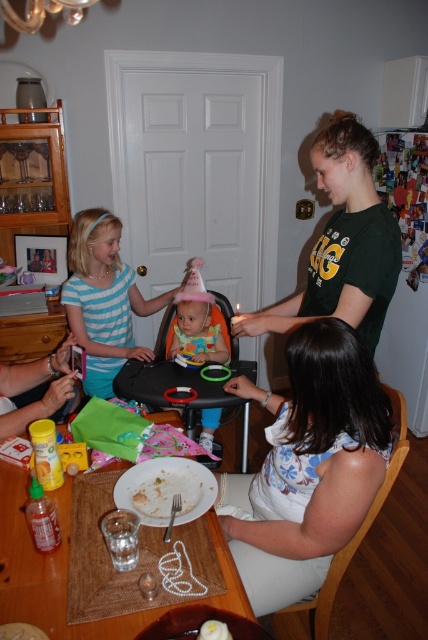
Is white ceramic plate at lower center to the left of striped fabric dress at center from the viewer's perspective?

In fact, white ceramic plate at lower center is to the right of striped fabric dress at center.

Is white ceramic plate at lower center wider than striped fabric dress at center?

Indeed, white ceramic plate at lower center has a greater width compared to striped fabric dress at center.

Describe the element at coordinates (47, 570) in the screenshot. I see `white ceramic plate at lower center` at that location.

Find the location of `white ceramic plate at lower center`. white ceramic plate at lower center is located at coordinates coord(47,570).

This screenshot has height=640, width=428. Describe the element at coordinates (308, 467) in the screenshot. I see `white floral tank top at lower center` at that location.

Can you confirm if white floral tank top at lower center is positioned to the left of matte pink party hat at center?

Incorrect, white floral tank top at lower center is not on the left side of matte pink party hat at center.

Between point (300, 456) and point (202, 259), which one is positioned in front?

Point (300, 456) is in front.

The image size is (428, 640). I want to click on white floral tank top at lower center, so click(x=308, y=467).

Between point (113, 282) and point (205, 410), which one is positioned in front?

Point (113, 282) is more forward.

Between striped fabric dress at center and matte pink party hat at center, which one has less height?

With less height is matte pink party hat at center.

Does point (76, 298) come closer to viewer compared to point (205, 356)?

No, it is behind (205, 356).

I want to click on striped fabric dress at center, so click(x=104, y=300).